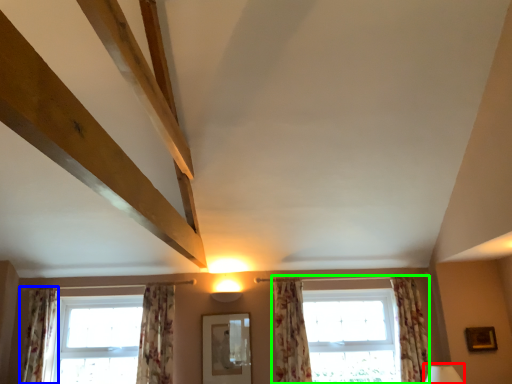
Question: Which object is positioned farthest from table lamp (highlighted by a red box)? Select from curtain (highlighted by a blue box) and window (highlighted by a green box).

Choices:
 (A) curtain
 (B) window

Answer: (A)